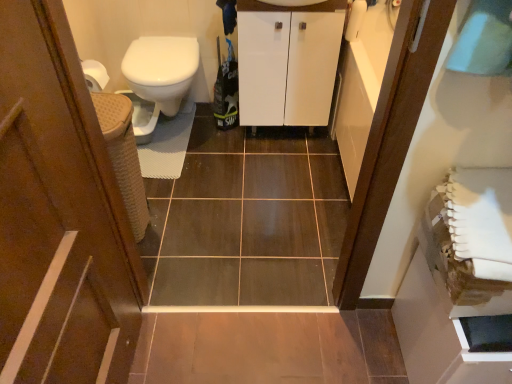
Question: Looking at the image, does white glossy bidet at left seem bigger or smaller compared to white glossy cabinet at center?

Choices:
 (A) big
 (B) small

Answer: (B)

Question: Considering their positions, is white glossy bidet at left located in front of or behind white glossy cabinet at center?

Choices:
 (A) behind
 (B) front

Answer: (A)

Question: Which of these objects is positioned farthest from the white glossy bidet at left?

Choices:
 (A) brown wood door at left
 (B) white glossy cabinet at center

Answer: (A)

Question: Estimate the real-world distances between objects in this image. Which object is closer to the white glossy bidet at left?

Choices:
 (A) brown wood door at left
 (B) white glossy cabinet at center

Answer: (B)